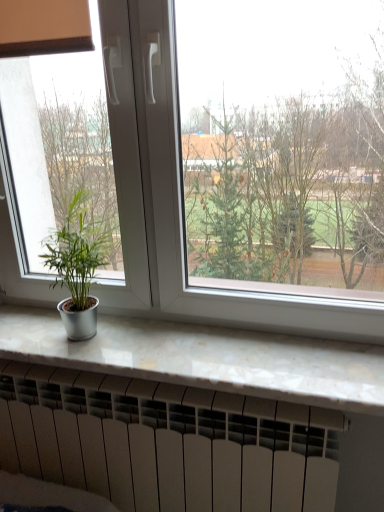
In order to click on vacant area situated below white plastic window at center (from a real-world perspective) in this screenshot , I will do `click(190, 333)`.